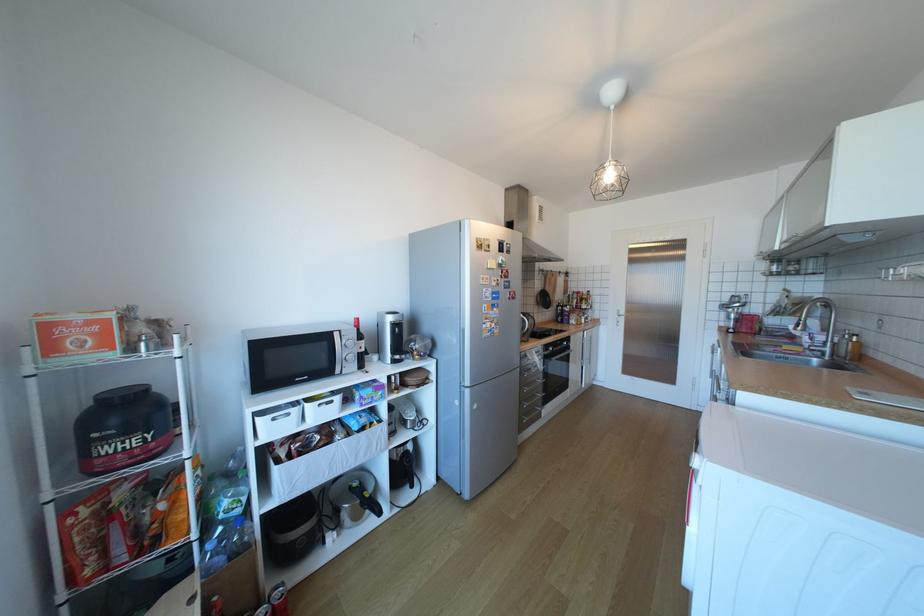
You are a GUI agent. You are given a task and a screenshot of the screen. Output one action in this format:
    pyautogui.click(x=<x>, y=<y>)
    Task: Click on the kitchen faucet handle
    
    Given the screenshot: What is the action you would take?
    812,341